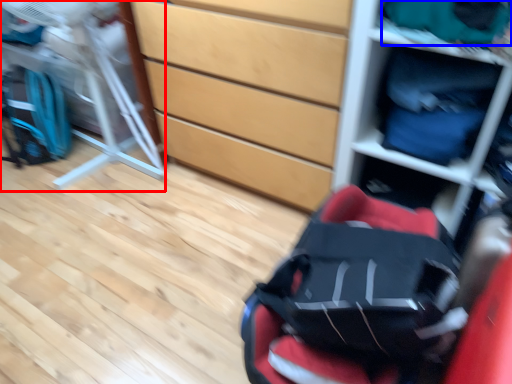
Question: Which of the following is the closest to the observer, folding chair (highlighted by a red box) or clothing (highlighted by a blue box)?

Choices:
 (A) folding chair
 (B) clothing

Answer: (B)